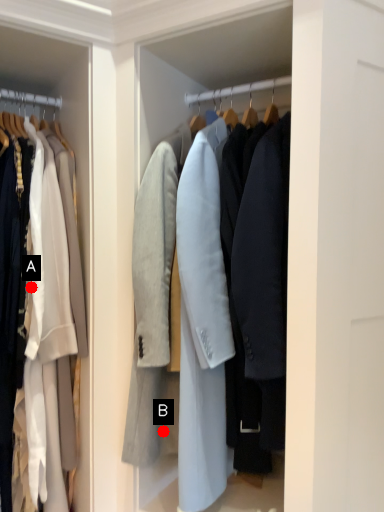
Question: Two points are circled on the image, labeled by A and B beside each circle. Which point is closer to the camera taking this photo?

Choices:
 (A) A is closer
 (B) B is closer

Answer: (A)